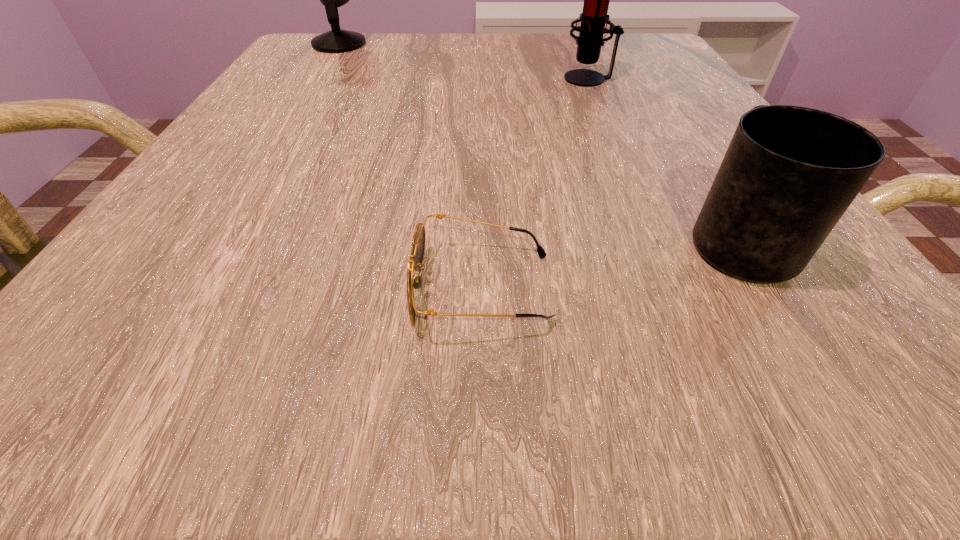
This screenshot has height=540, width=960. I want to click on vacant space located 0.060m on the side of the second shortest object with the handle, so click(697, 172).

In order to click on vacant space located 0.100m on the side of the second shortest object with the handle in this screenshot , I will do `click(687, 156)`.

The width and height of the screenshot is (960, 540). In order to click on blank space located on the lenses of the third object from right to left in this screenshot , I will do `click(222, 288)`.

Locate an element on the screen. The height and width of the screenshot is (540, 960). free space located 0.230m on the lenses of the third object from right to left is located at coordinates (182, 288).

Where is `vacant space located on the lenses of the third object from right to left`? This screenshot has height=540, width=960. vacant space located on the lenses of the third object from right to left is located at coordinates (112, 288).

At what (x,y) coordinates should I click in order to perform the action: click on object that is at the near edge. Please return your answer as a coordinate pair (x, y). This screenshot has width=960, height=540. Looking at the image, I should click on (418, 244).

The height and width of the screenshot is (540, 960). Find the location of `object present at the left edge`. object present at the left edge is located at coordinates (336, 40).

At what (x,y) coordinates should I click in order to perform the action: click on microphone situated at the right edge. Please return your answer as a coordinate pair (x, y). The height and width of the screenshot is (540, 960). Looking at the image, I should click on (593, 18).

Where is `mug present at the right edge`? The width and height of the screenshot is (960, 540). mug present at the right edge is located at coordinates (789, 174).

You are a GUI agent. You are given a task and a screenshot of the screen. Output one action in this format:
    pyautogui.click(x=<x>, y=<y>)
    Task: Click on the object that is positioned at the far left corner
    This screenshot has height=540, width=960.
    Given the screenshot: What is the action you would take?
    pyautogui.click(x=336, y=40)